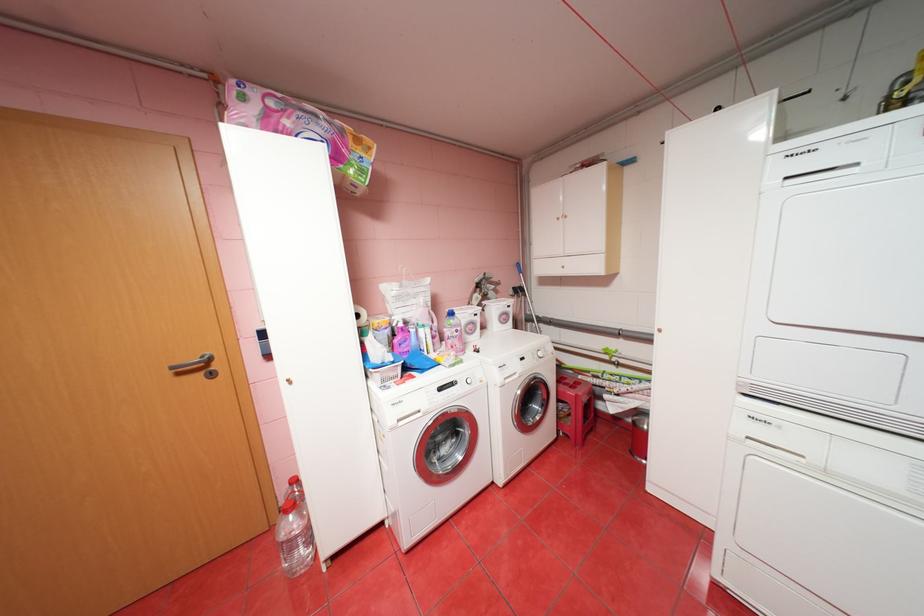
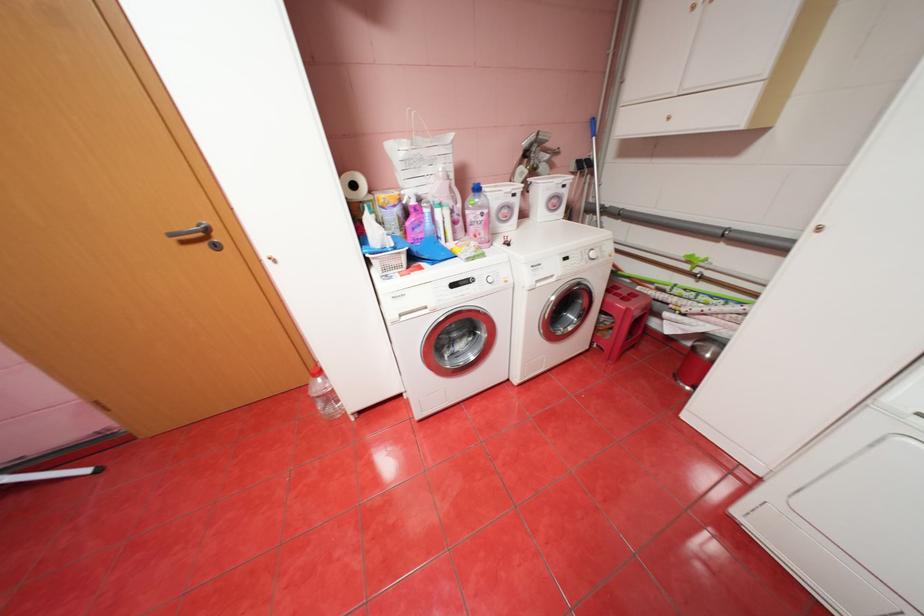
In the second image, find the point that corresponds to (459,384) in the first image.

(476, 281)